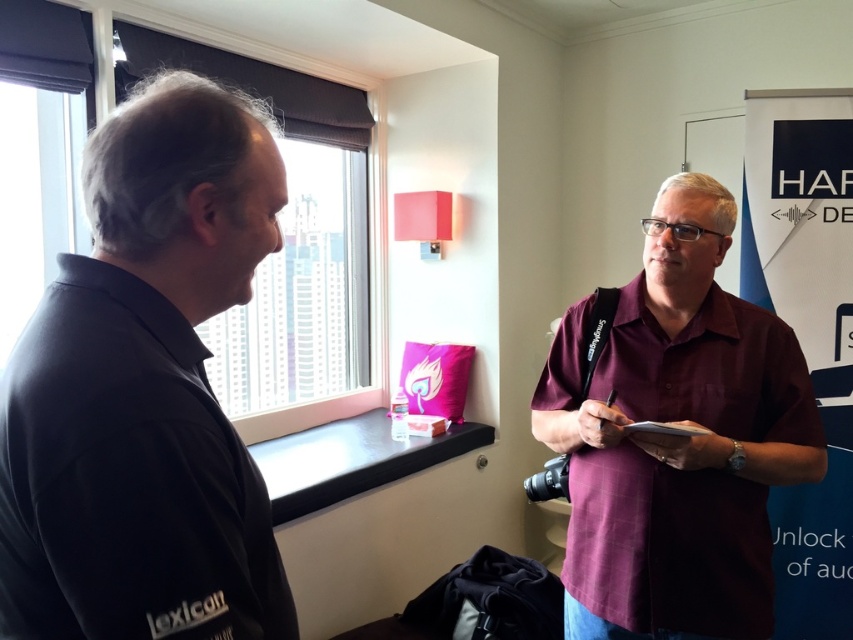
You are a delivery person trying to place a package between the transparent glass window at upper left and the dark matte window at upper left. The package measures 16 inches in length. Can you fit it between them?

The distance between the transparent glass window at upper left and the dark matte window at upper left is 15.64 inches, which is shorter than the package length of 16 inches. The package cannot fit between them.

You are an interior designer planning to place a new desk between the maroon plaid shirt at right and the dark matte window at upper left. Based on their positions, where should the desk be placed to ensure it is between both objects?

The desk should be placed below the dark matte window at upper left and above the maroon plaid shirt at right since the maroon plaid shirt at right is located below the dark matte window at upper left.

You are standing in the room where the two people are talking. You want to look outside through the transparent glass window at upper left. Which direction should you face?

You should face the upper left direction to look outside through the transparent glass window at upper left since it is located at point (38, 152) in the scene.